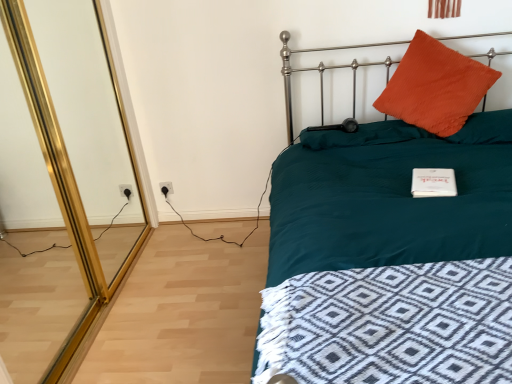
Question: From a real-world perspective, is orange fuzzy pillow at upper right, acting as the 3th pillow starting from the right, above or below white plastic electric outlet at lower left?

Choices:
 (A) above
 (B) below

Answer: (A)

Question: In terms of size, does orange fuzzy pillow at upper right, which is the 1th pillow from left to right, appear bigger or smaller than white plastic electric outlet at lower left?

Choices:
 (A) big
 (B) small

Answer: (A)

Question: Considering the real-world distances, which object is closest to the white plastic electric outlet at lower left?

Choices:
 (A) orange fuzzy pillow at upper right, acting as the 3th pillow starting from the right
 (B) orange corduroy pillow at upper right, arranged as the second pillow when viewed from the left
 (C) teal fabric bed at upper right
 (D) orange corduroy pillow at upper right, marked as the 3th pillow in a left-to-right arrangement
 (E) gold mirrored screen door at left

Answer: (E)

Question: Considering the real-world distances, which object is closest to the white plastic electric outlet at lower left?

Choices:
 (A) teal fabric bed at upper right
 (B) gold mirrored screen door at left
 (C) orange fuzzy pillow at upper right, acting as the 3th pillow starting from the right
 (D) orange corduroy pillow at upper right, arranged as the second pillow when viewed from the left
 (E) orange corduroy pillow at upper right, the 1th pillow from the right

Answer: (B)